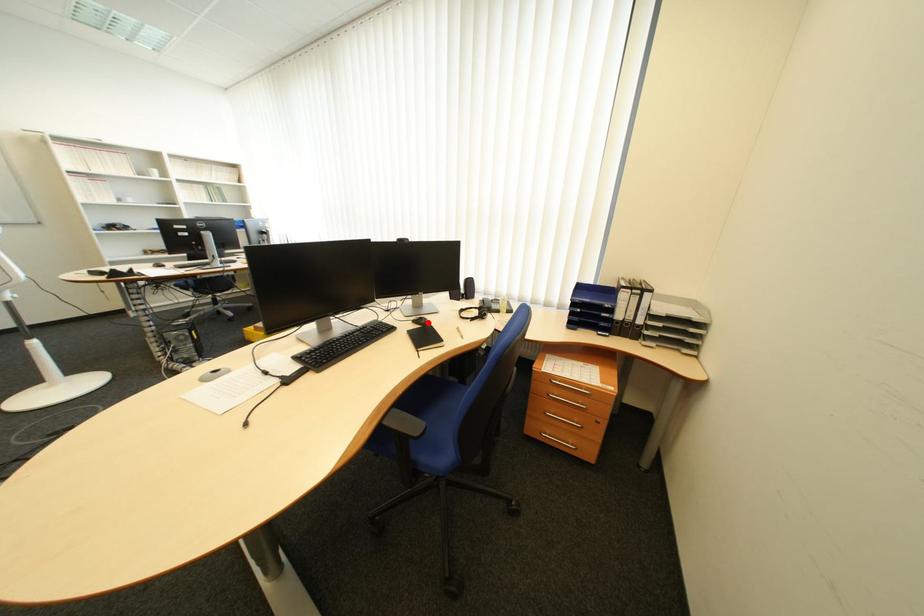
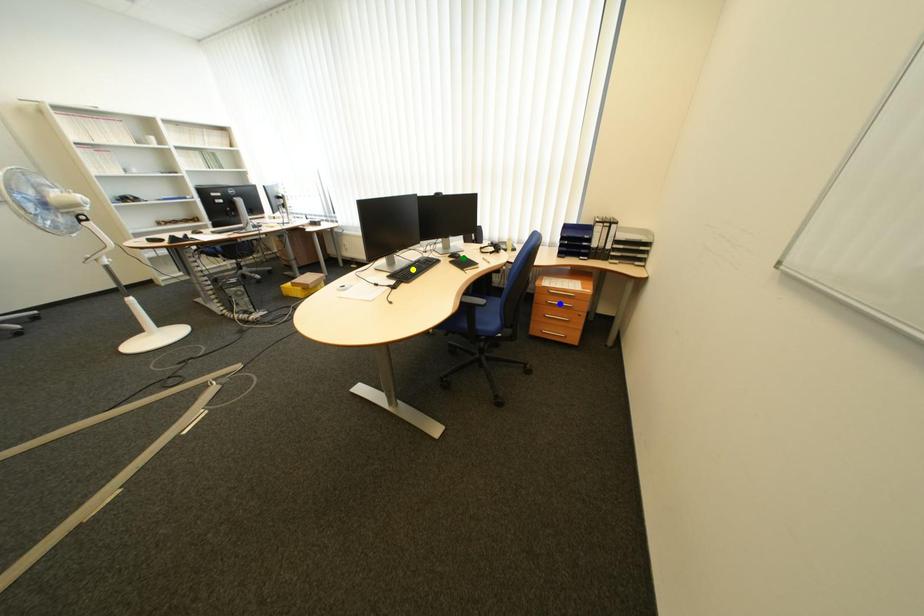
Question: I am providing you with two images of the same scene from different viewpoints. A red point is marked on the first image. You are given multiple points on the second image. Which mark in image 2 goes with the point in image 1?

Choices:
 (A) yellow point
 (B) blue point
 (C) green point

Answer: (C)